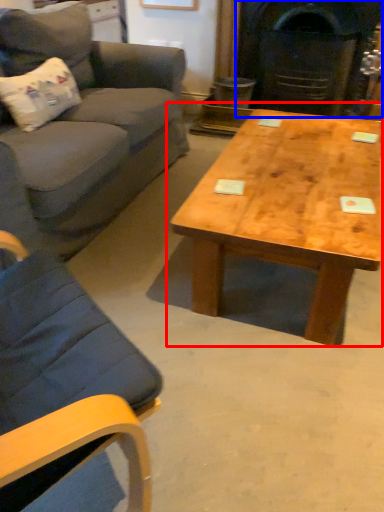
Question: Which of the following is the farthest to the observer, coffee table (highlighted by a red box) or fireplace (highlighted by a blue box)?

Choices:
 (A) coffee table
 (B) fireplace

Answer: (B)